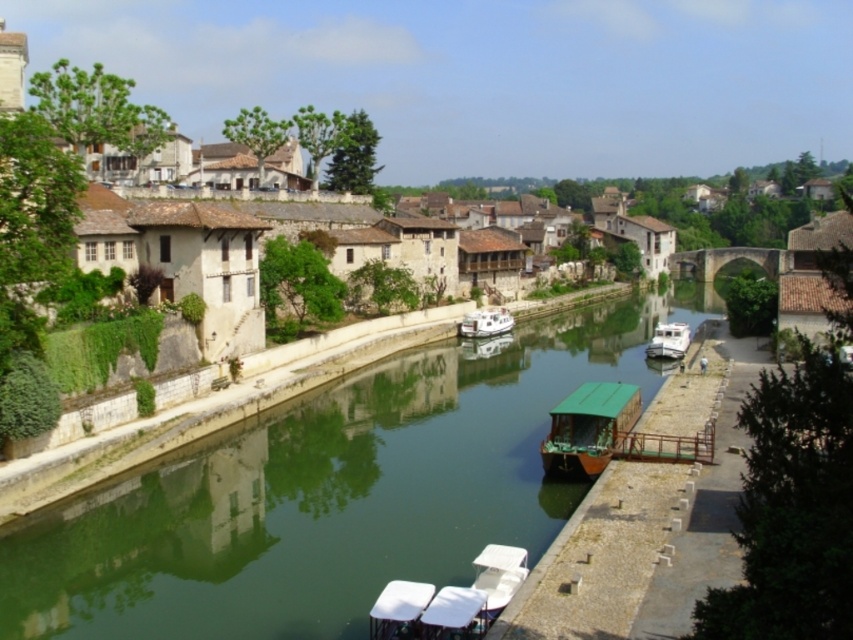
Question: Is green smooth water at center to the right of white glossy houseboat at center from the viewer's perspective?

Choices:
 (A) no
 (B) yes

Answer: (B)

Question: Which is farther from the green matte boat at center?

Choices:
 (A) white matte boat at center-right
 (B) green smooth water at center

Answer: (A)

Question: Is green smooth water at center above white matte boat at center-right?

Choices:
 (A) no
 (B) yes

Answer: (A)

Question: Among these points, which one is nearest to the camera?

Choices:
 (A) (489, 308)
 (B) (685, 332)
 (C) (631, 388)
 (D) (415, 451)

Answer: (C)

Question: Is green matte boat at center smaller than white matte boat at center-right?

Choices:
 (A) yes
 (B) no

Answer: (A)

Question: Which object is positioned farthest from the green matte boat at center?

Choices:
 (A) white matte boat at center-right
 (B) green smooth water at center

Answer: (A)